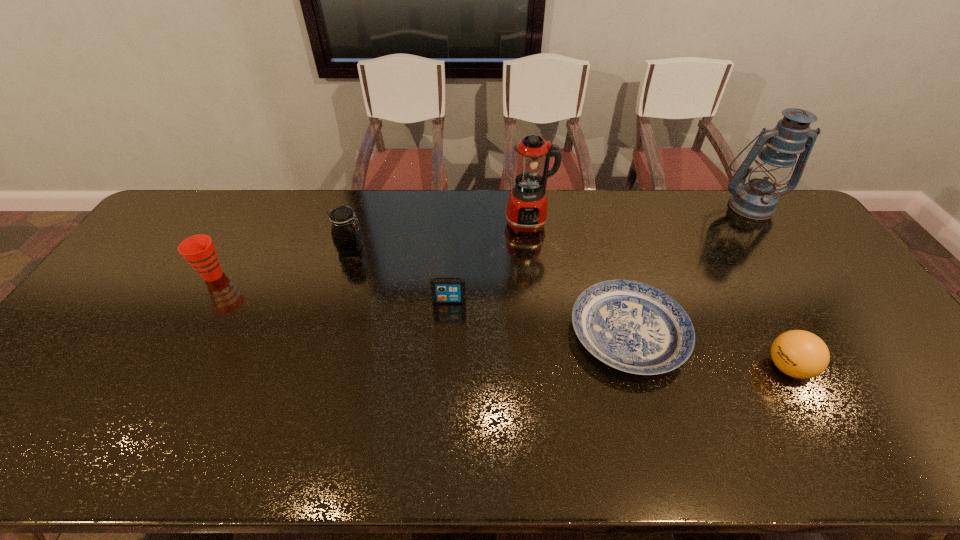
Find the location of a particular element. vacant space that satisfies the following two spatial constraints: 1. on the lid of the plate; 2. on the right side of the third farthest object is located at coordinates (324, 333).

The height and width of the screenshot is (540, 960). I want to click on vacant point that satisfies the following two spatial constraints: 1. on the front screen of the iPod; 2. on the right side of the plate, so click(447, 333).

Identify the location of free location that satisfies the following two spatial constraints: 1. on the lid of the jar; 2. on the back side of the shortest object. (324, 333).